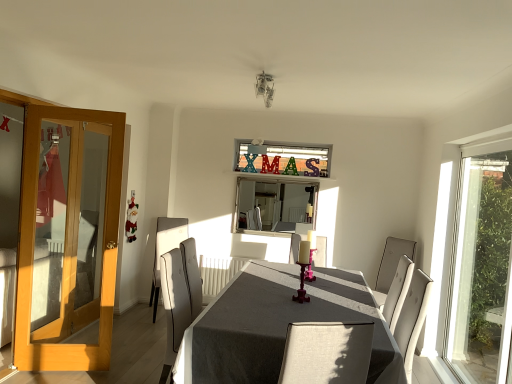
The image size is (512, 384). In order to click on light gray fabric chair at center, the second chair in the right-to-left sequence in this screenshot , I will do `click(165, 250)`.

This screenshot has width=512, height=384. What do you see at coordinates (391, 265) in the screenshot?
I see `white fabric chair at right, the 1th chair when ordered from right to left` at bounding box center [391, 265].

This screenshot has width=512, height=384. What do you see at coordinates (277, 326) in the screenshot?
I see `gray fabric table at center` at bounding box center [277, 326].

Image resolution: width=512 pixels, height=384 pixels. I want to click on pink glossy candle holder at center, so click(x=303, y=270).

Where is `light brown wooden door at left`? This screenshot has width=512, height=384. light brown wooden door at left is located at coordinates (69, 233).

In terms of height, does light brown wooden door at left look taller or shorter compared to light gray fabric chair at center, the 1th chair positioned from the left?

In the image, light brown wooden door at left appears to be taller than light gray fabric chair at center, the 1th chair positioned from the left.

From the image's perspective, is light brown wooden door at left located above light gray fabric chair at center, the 1th chair positioned from the left?

Yes, from the image's perspective, light brown wooden door at left is on top of light gray fabric chair at center, the 1th chair positioned from the left.

Is light brown wooden door at left next to light gray fabric chair at center, the second chair in the right-to-left sequence, and touching it?

No, light brown wooden door at left is not beside light gray fabric chair at center, the second chair in the right-to-left sequence.

Is light brown wooden door at left oriented away from light gray fabric chair at center, the second chair in the right-to-left sequence?

No, light brown wooden door at left's orientation is not away from light gray fabric chair at center, the second chair in the right-to-left sequence.

Could you tell me if light gray fabric chair at center, the second chair in the right-to-left sequence, is turned towards silver metallic mirror at center?

No, light gray fabric chair at center, the second chair in the right-to-left sequence, is not aimed at silver metallic mirror at center.

Between light gray fabric chair at center, the 1th chair positioned from the left, and silver metallic mirror at center, which one has less height?

silver metallic mirror at center is shorter.

Which object is positioned more to the left, light gray fabric chair at center, the 1th chair positioned from the left, or silver metallic mirror at center?

From the viewer's perspective, light gray fabric chair at center, the 1th chair positioned from the left, appears more on the left side.

Is light gray fabric chair at center, the second chair in the right-to-left sequence, directly adjacent to silver metallic mirror at center?

No, light gray fabric chair at center, the second chair in the right-to-left sequence, is not making contact with silver metallic mirror at center.

From the image's perspective, is gray fabric table at center under light brown wooden door at left?

Yes, from the image's perspective, gray fabric table at center is beneath light brown wooden door at left.

Considering the positions of objects gray fabric table at center and light brown wooden door at left in the image provided, who is more to the left, gray fabric table at center or light brown wooden door at left?

From the viewer's perspective, light brown wooden door at left appears more on the left side.

Is gray fabric table at center positioned with its back to light brown wooden door at left?

No.

Would you say gray fabric table at center is inside or outside light brown wooden door at left?

gray fabric table at center is not inside light brown wooden door at left, it's outside.

Find the location of `candle holder on the right of light gray fabric chair at center, the second chair in the right-to-left sequence`. candle holder on the right of light gray fabric chair at center, the second chair in the right-to-left sequence is located at coordinates (303, 270).

Looking at this image, considering the relative sizes of pink glossy candle holder at center and light gray fabric chair at center, the 1th chair positioned from the left, in the image provided, is pink glossy candle holder at center taller than light gray fabric chair at center, the 1th chair positioned from the left,?

Incorrect, the height of pink glossy candle holder at center is not larger of that of light gray fabric chair at center, the 1th chair positioned from the left.

From a real-world perspective, between pink glossy candle holder at center and light gray fabric chair at center, the 1th chair positioned from the left, who is vertically higher?

In real-world perspective, pink glossy candle holder at center is above.

Is pink glossy candle holder at center positioned far away from light gray fabric chair at center, the 1th chair positioned from the left?

pink glossy candle holder at center is far away from light gray fabric chair at center, the 1th chair positioned from the left.

Is white fabric chair at right, the 1th chair when ordered from right to left, beside light brown wooden door at left?

white fabric chair at right, the 1th chair when ordered from right to left, and light brown wooden door at left are not in contact.

How different are the orientations of white fabric chair at right, the 1th chair when ordered from right to left, and light brown wooden door at left in degrees?

The angular difference between white fabric chair at right, the 1th chair when ordered from right to left, and light brown wooden door at left is 68 degrees.

Considering the points (385, 285) and (44, 328), which point is in front, point (385, 285) or point (44, 328)?

The point (44, 328) is closer.

This screenshot has height=384, width=512. What are the coordinates of `door that appears above the white fabric chair at right, which is counted as the second chair, starting from the left (from the image's perspective)` in the screenshot? It's located at (69, 233).

Can you tell me how much pink glossy candle holder at center and silver metallic mirror at center differ in facing direction?

They differ by 93.2 degrees in their facing directions.

In terms of height, does pink glossy candle holder at center look taller or shorter compared to silver metallic mirror at center?

Considering their sizes, pink glossy candle holder at center has less height than silver metallic mirror at center.

Could you tell me if pink glossy candle holder at center is facing silver metallic mirror at center?

No, pink glossy candle holder at center is not oriented towards silver metallic mirror at center.

Is pink glossy candle holder at center at the right side of silver metallic mirror at center?

Yes.

Could you tell me if light gray fabric chair at center, the 1th chair positioned from the left, is facing pink glossy candle holder at center?

Yes.

Are light gray fabric chair at center, the second chair in the right-to-left sequence, and pink glossy candle holder at center far apart?

Yes.

Is light gray fabric chair at center, the 1th chair positioned from the left, to the left of pink glossy candle holder at center from the viewer's perspective?

Yes, light gray fabric chair at center, the 1th chair positioned from the left, is to the left of pink glossy candle holder at center.

Would you say light gray fabric chair at center, the second chair in the right-to-left sequence, is outside pink glossy candle holder at center?

light gray fabric chair at center, the second chair in the right-to-left sequence, is positioned outside pink glossy candle holder at center.

This screenshot has height=384, width=512. In order to click on door above the light gray fabric chair at center, the 1th chair positioned from the left (from the image's perspective) in this screenshot , I will do tap(69, 233).

Identify the location of mirror that is on the right side of light gray fabric chair at center, the second chair in the right-to-left sequence. This screenshot has width=512, height=384. (273, 205).

In the scene shown: Which object lies nearer to the anchor point light brown wooden door at left, silver metallic mirror at center or gray fabric table at center?

gray fabric table at center is positioned closer to the anchor light brown wooden door at left.

Considering their positions, is white fabric chair at right, which is counted as the second chair, starting from the left, positioned closer to gray fabric table at center than pink glossy candle holder at center?

pink glossy candle holder at center lies closer to gray fabric table at center than the other object.

Based on their spatial positions, is gray fabric table at center or white fabric chair at right, the 1th chair when ordered from right to left, further from light gray fabric chair at center, the second chair in the right-to-left sequence?

white fabric chair at right, the 1th chair when ordered from right to left, is positioned further to the anchor light gray fabric chair at center, the second chair in the right-to-left sequence.

From the image, which object appears to be farther from silver metallic mirror at center, light brown wooden door at left or pink glossy candle holder at center?

The object further to silver metallic mirror at center is light brown wooden door at left.

When comparing their distances from pink glossy candle holder at center, does silver metallic mirror at center or gray fabric table at center seem further?

silver metallic mirror at center is further to pink glossy candle holder at center.

Which object lies nearer to the anchor point pink glossy candle holder at center, light brown wooden door at left or white fabric chair at right, which is counted as the second chair, starting from the left?

Among the two, white fabric chair at right, which is counted as the second chair, starting from the left, is located nearer to pink glossy candle holder at center.

Based on their spatial positions, is white fabric chair at right, the 1th chair when ordered from right to left, or pink glossy candle holder at center closer to silver metallic mirror at center?

The object closer to silver metallic mirror at center is white fabric chair at right, the 1th chair when ordered from right to left.

Based on their spatial positions, is light gray fabric chair at center, the 1th chair positioned from the left, or light brown wooden door at left closer to pink glossy candle holder at center?

light gray fabric chair at center, the 1th chair positioned from the left.

Locate an element on the screen. door positioned between gray fabric table at center and silver metallic mirror at center from near to far is located at coordinates (69, 233).

In order to click on table between light brown wooden door at left and pink glossy candle holder at center in this screenshot , I will do `click(277, 326)`.

Where is `chair between light brown wooden door at left and white fabric chair at right, which is counted as the second chair, starting from the left, from left to right`? This screenshot has height=384, width=512. chair between light brown wooden door at left and white fabric chair at right, which is counted as the second chair, starting from the left, from left to right is located at coordinates (165, 250).

You are a GUI agent. You are given a task and a screenshot of the screen. Output one action in this format:
    pyautogui.click(x=<x>, y=<y>)
    Task: Click on the candle holder positioned between gray fabric table at center and white fabric chair at right, which is counted as the second chair, starting from the left, from near to far
    
    Given the screenshot: What is the action you would take?
    pyautogui.click(x=303, y=270)